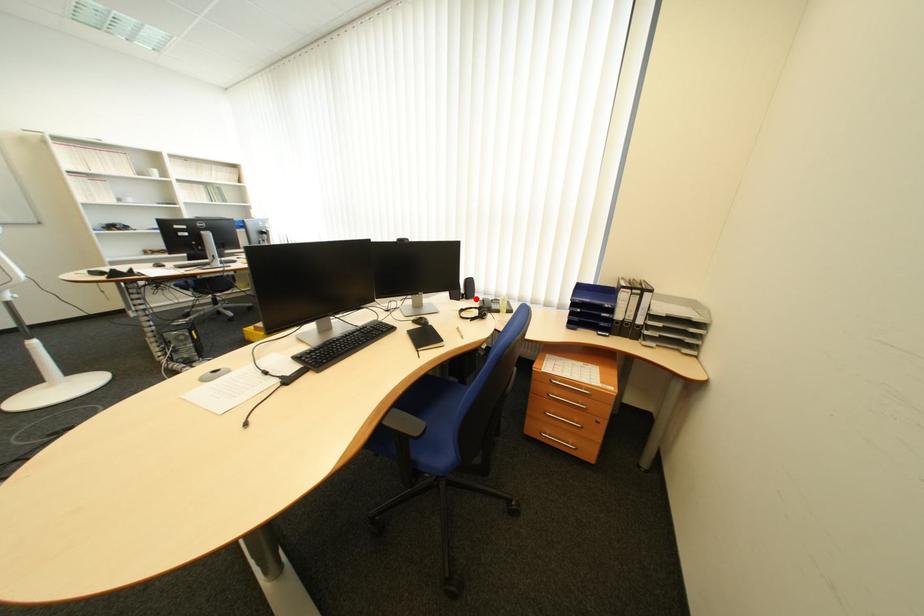
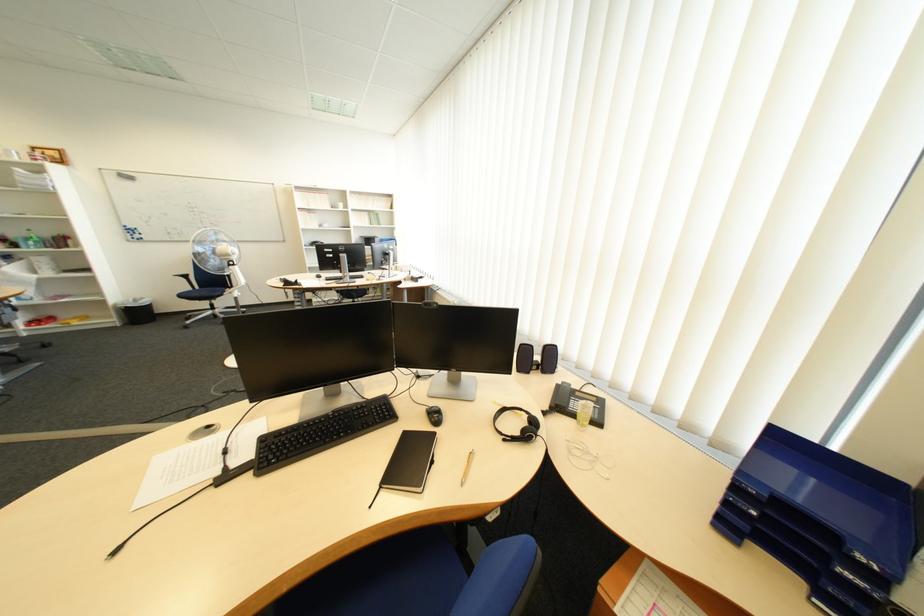
In the second image, find the point that corresponds to the highlighted location in the first image.

(551, 370)